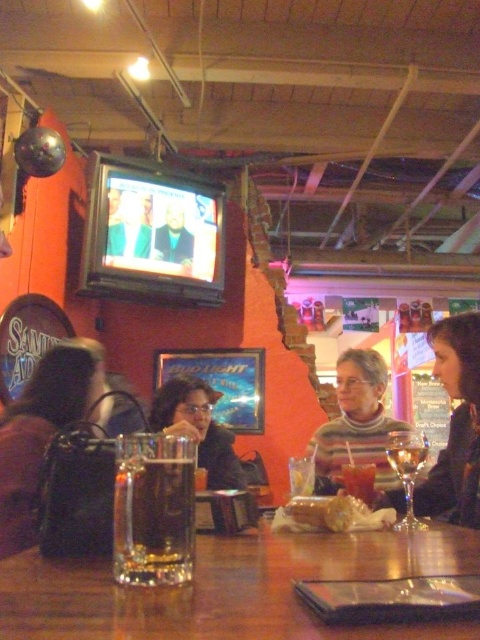
You are sitting at the wooden table in the bar. You want to locate the smooth black jacket at upper center. Where should you look?

The smooth black jacket at upper center is located at position coordinates point [173,237].

You are at a bar and want to grab both the translucent glass beer at center and the clear glass wine glass at lower right. Which one should you pick up first to avoid knocking over the other?

You should pick up the translucent glass beer at center first because it is positioned to the left of the clear glass wine glass at lower right, so moving it first would prevent accidentally bumping into the wine glass.

You are a bartender who needs to determine which object is bigger between the smooth black jacket at upper center and the translucent glass wine at center. Which one is bigger?

The smooth black jacket at upper center is larger in size than the translucent glass wine at center.